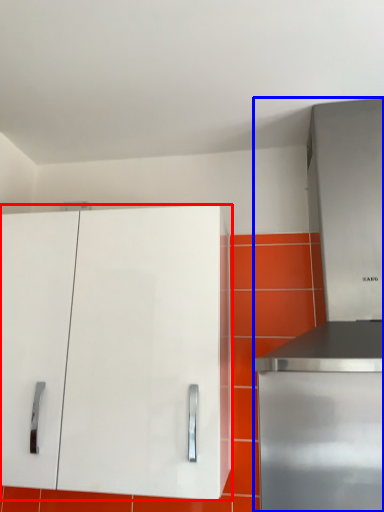
Question: Which object appears farthest to the camera in this image, cabinetry (highlighted by a red box) or appliance (highlighted by a blue box)?

Choices:
 (A) cabinetry
 (B) appliance

Answer: (A)